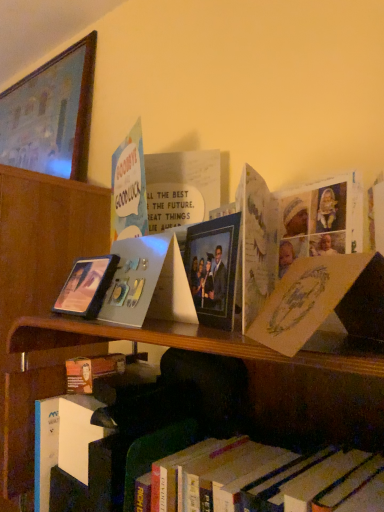
Question: Can you confirm if wooden picture frame at upper left, the third picture frame in the right-to-left sequence, is shorter than pastel paper card at upper left?

Choices:
 (A) yes
 (B) no

Answer: (B)

Question: Can you confirm if wooden picture frame at upper left, which ranks as the 1th picture frame in back-to-front order, is thinner than pastel paper card at upper left?

Choices:
 (A) no
 (B) yes

Answer: (A)

Question: Considering the relative sizes of wooden picture frame at upper left, marked as the 1th picture frame in a top-to-bottom arrangement, and pastel paper card at upper left in the image provided, is wooden picture frame at upper left, marked as the 1th picture frame in a top-to-bottom arrangement, wider than pastel paper card at upper left?

Choices:
 (A) yes
 (B) no

Answer: (A)

Question: Could you tell me if wooden picture frame at upper left, marked as the 1th picture frame in a top-to-bottom arrangement, is turned towards pastel paper card at upper left?

Choices:
 (A) no
 (B) yes

Answer: (A)

Question: Is wooden picture frame at upper left, which is the 3th picture frame in bottom-to-top order, looking in the opposite direction of pastel paper card at upper left?

Choices:
 (A) yes
 (B) no

Answer: (B)

Question: From their relative heights in the image, would you say matte plastic picture frame at center, the 2th picture frame from the top, is taller or shorter than yellow paper at upper right, placed as the 1th paperback book when sorted from front to back?

Choices:
 (A) short
 (B) tall

Answer: (B)

Question: In terms of width, does matte plastic picture frame at center, the first picture frame in the right-to-left sequence, look wider or thinner when compared to yellow paper at upper right, arranged as the 2th paperback book when viewed from the left?

Choices:
 (A) wide
 (B) thin

Answer: (B)

Question: Does point (193, 275) appear closer or farther from the camera than point (281, 343)?

Choices:
 (A) farther
 (B) closer

Answer: (A)

Question: From a real-world perspective, is matte plastic picture frame at center, the 1th picture frame from the front, physically located above or below yellow paper at upper right, the second paperback book in the back-to-front sequence?

Choices:
 (A) below
 (B) above

Answer: (B)

Question: Based on their positions, is wooden picture frame at upper left, the third picture frame in the right-to-left sequence, located to the left or right of pastel paper card at upper left?

Choices:
 (A) right
 (B) left

Answer: (B)

Question: From a real-world perspective, relative to pastel paper card at upper left, is wooden picture frame at upper left, marked as the 1th picture frame in a top-to-bottom arrangement, vertically above or below?

Choices:
 (A) above
 (B) below

Answer: (A)

Question: Considering the positions of wooden picture frame at upper left, which appears as the 1th picture frame when viewed from the left, and pastel paper card at upper left in the image, is wooden picture frame at upper left, which appears as the 1th picture frame when viewed from the left, taller or shorter than pastel paper card at upper left?

Choices:
 (A) tall
 (B) short

Answer: (A)

Question: Is wooden picture frame at upper left, which appears as the 1th picture frame when viewed from the left, bigger or smaller than pastel paper card at upper left?

Choices:
 (A) small
 (B) big

Answer: (B)

Question: From a real-world perspective, is wooden picture frame at upper left, the third picture frame in the right-to-left sequence, physically located above or below matte black picture frame at left, the 3th picture frame positioned from the top?

Choices:
 (A) below
 (B) above

Answer: (B)

Question: Is wooden picture frame at upper left, marked as the 1th picture frame in a top-to-bottom arrangement, inside or outside of matte black picture frame at left, the second picture frame when ordered from left to right?

Choices:
 (A) outside
 (B) inside

Answer: (A)